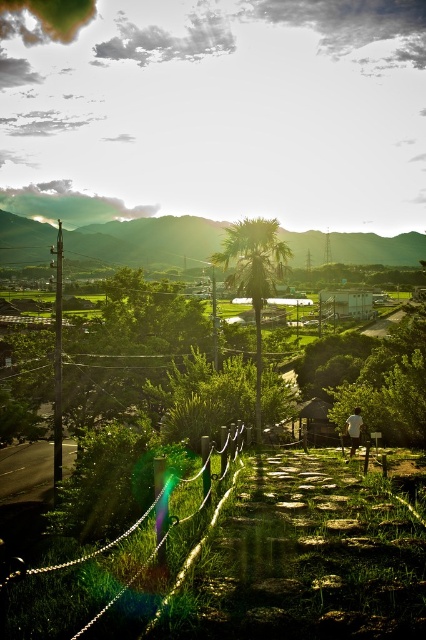
Who is taller, green chain-link fence at lower left or green grassy hillside at center?

Standing taller between the two is green grassy hillside at center.

Does green chain-link fence at lower left have a smaller size compared to green grassy hillside at center?

Yes, green chain-link fence at lower left is smaller than green grassy hillside at center.

Measure the distance between green chain-link fence at lower left and camera.

The distance of green chain-link fence at lower left from camera is 8.59 feet.

Locate an element on the screen. The width and height of the screenshot is (426, 640). green chain-link fence at lower left is located at coordinates (104, 572).

Between green chain-link fence at lower left and white cotton shirt at lower right, which one is positioned lower?

white cotton shirt at lower right is lower down.

Is green chain-link fence at lower left above white cotton shirt at lower right?

Indeed, green chain-link fence at lower left is positioned over white cotton shirt at lower right.

I want to click on green chain-link fence at lower left, so click(104, 572).

The width and height of the screenshot is (426, 640). I want to click on green chain-link fence at lower left, so click(x=104, y=572).

Looking at this image, who is taller, green grassy hillside at center or green leafy palm tree at center?

green grassy hillside at center is taller.

Which of these two, green grassy hillside at center or green leafy palm tree at center, stands shorter?

Standing shorter between the two is green leafy palm tree at center.

Does point (120, 236) lie behind point (270, 284)?

Yes.

Where is `green grassy hillside at center`? The width and height of the screenshot is (426, 640). green grassy hillside at center is located at coordinates (147, 241).